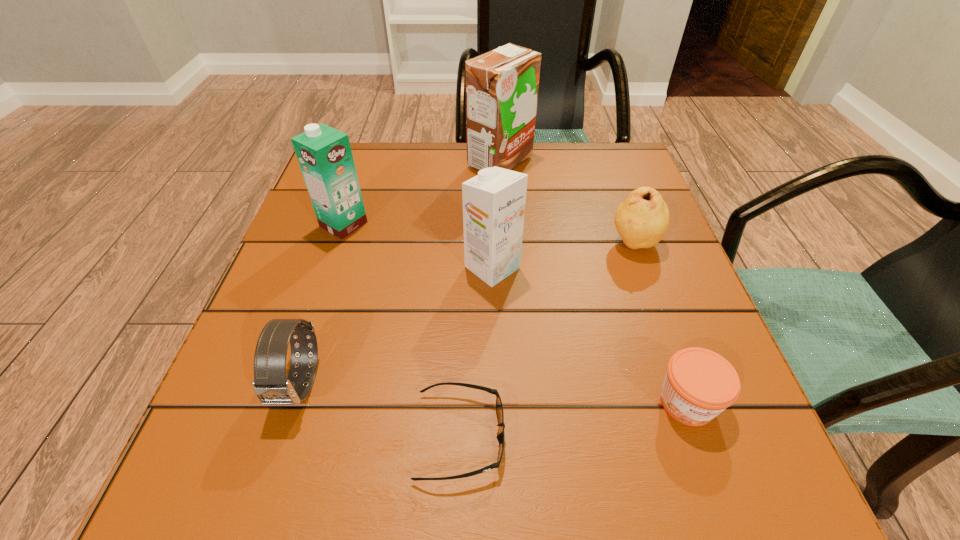
Locate an element on the screen. The image size is (960, 540). free space located 0.130m on the straw side of the farthest object is located at coordinates (413, 161).

This screenshot has height=540, width=960. What are the coordinates of `vacant space located on the right of the second nearest carton` in the screenshot? It's located at (466, 224).

At what (x,y) coordinates should I click in order to perform the action: click on vacant space located 0.180m on the back of the nearest carton. Please return your answer as a coordinate pair (x, y). Looking at the image, I should click on (491, 194).

Locate an element on the screen. The width and height of the screenshot is (960, 540). vacant area situated 0.240m on the front of the pear is located at coordinates (680, 368).

At what (x,y) coordinates should I click in order to perform the action: click on vacant space positioned 0.110m on the face of the watch. Please return your answer as a coordinate pair (x, y). Looking at the image, I should click on (261, 507).

You are a GUI agent. You are given a task and a screenshot of the screen. Output one action in this format:
    pyautogui.click(x=<x>, y=<y>)
    Task: Click on the blank space located on the front label of the second shortest object
    The height and width of the screenshot is (540, 960).
    Given the screenshot: What is the action you would take?
    (717, 488)

You are a GUI agent. You are given a task and a screenshot of the screen. Output one action in this format:
    pyautogui.click(x=<x>, y=<y>)
    Task: Click on the free location located on the front-facing side of the sunglasses
    
    Given the screenshot: What is the action you would take?
    pyautogui.click(x=713, y=436)

This screenshot has height=540, width=960. Identify the location of object that is at the far edge. (502, 85).

The image size is (960, 540). Identify the location of object positioned at the near edge. (499, 407).

This screenshot has width=960, height=540. Find the location of `carton at the left edge`. carton at the left edge is located at coordinates (324, 154).